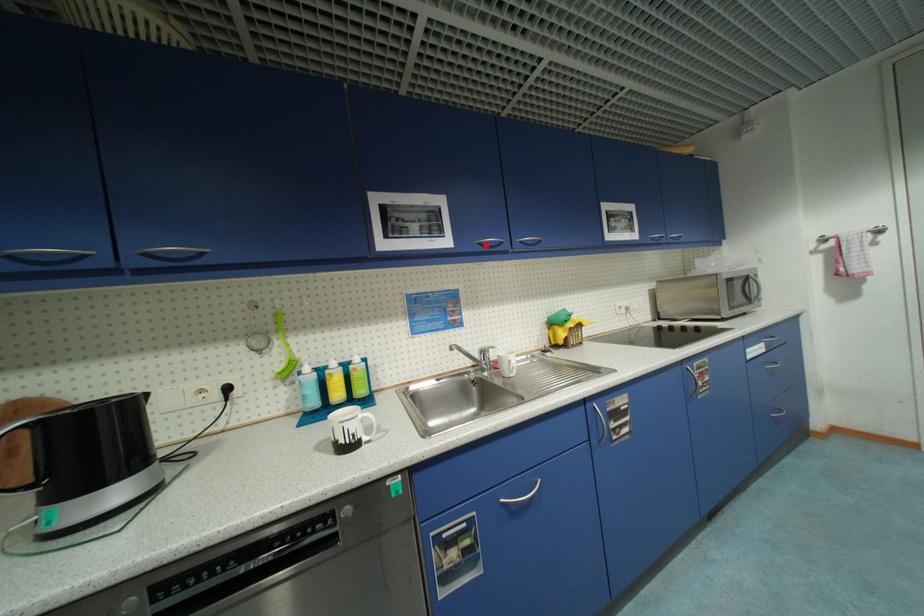
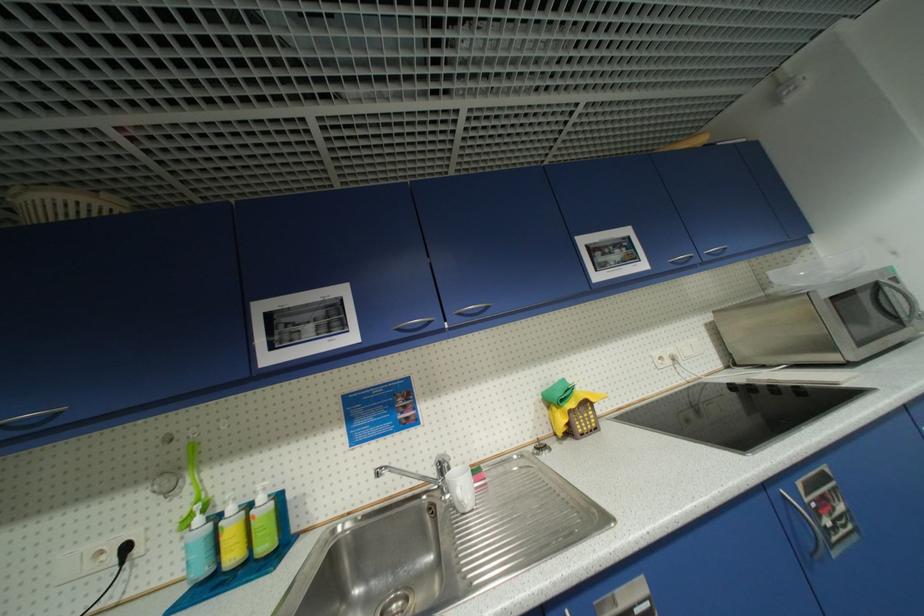
The point at the highlighted location is marked in the first image. Where is the corresponding point in the second image?

(405, 331)